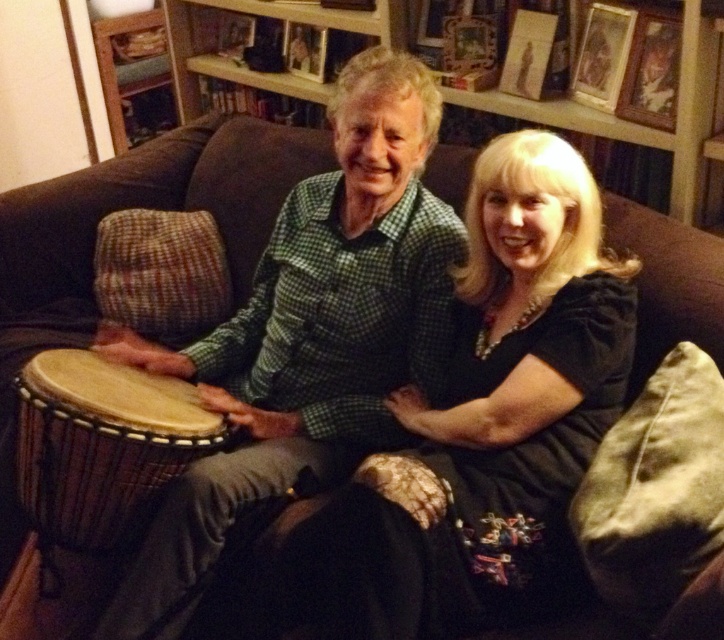
Does point (140, 449) come in front of point (636, 29)?

Yes, point (140, 449) is closer to viewer.

Between natural wood drum at center and wooden picture frame at upper right, which one has more height?

natural wood drum at center is taller.

Where is `natural wood drum at center`? natural wood drum at center is located at coordinates (101, 444).